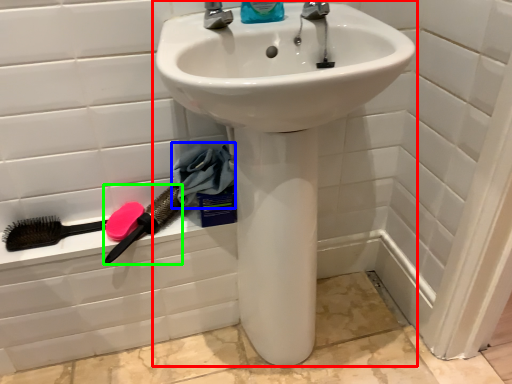
Question: Based on their relative distances, which object is farther from sink (highlighted by a red box)? Choose from material (highlighted by a blue box) and brush (highlighted by a green box).

Choices:
 (A) material
 (B) brush

Answer: (B)